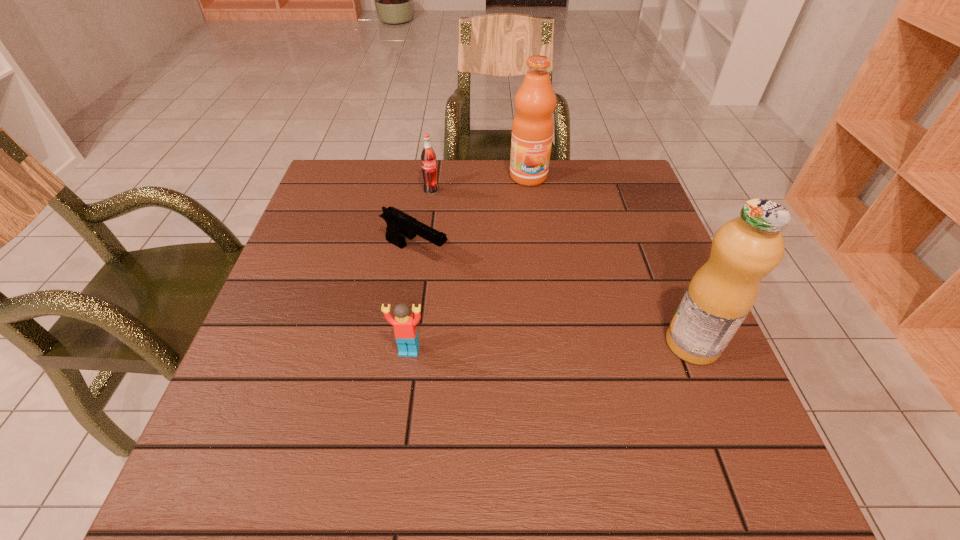
Find the location of a particular element. The height and width of the screenshot is (540, 960). the second shortest object is located at coordinates (404, 322).

Find the location of a particular element. The height and width of the screenshot is (540, 960). the right fruit juice is located at coordinates (745, 249).

Image resolution: width=960 pixels, height=540 pixels. I want to click on the rightmost object, so click(745, 249).

This screenshot has height=540, width=960. What are the coordinates of `the farther fruit juice` in the screenshot? It's located at (532, 129).

Where is `the second object from right to left`? Image resolution: width=960 pixels, height=540 pixels. the second object from right to left is located at coordinates (532, 129).

This screenshot has height=540, width=960. Find the location of `the third tallest object`. the third tallest object is located at coordinates (428, 157).

At what (x,y) coordinates should I click in order to perform the action: click on the shortest object. Please return your answer as a coordinate pair (x, y). The image size is (960, 540). Looking at the image, I should click on (400, 225).

You are a GUI agent. You are given a task and a screenshot of the screen. Output one action in this format:
    pyautogui.click(x=<x>, y=<y>)
    Task: Click on the pistol
    This screenshot has width=960, height=540.
    Given the screenshot: What is the action you would take?
    pyautogui.click(x=400, y=225)

The width and height of the screenshot is (960, 540). I want to click on free space located on the face of the second shortest object, so click(x=405, y=380).

This screenshot has width=960, height=540. I want to click on blank area located on the front label of the rightmost object, so click(535, 344).